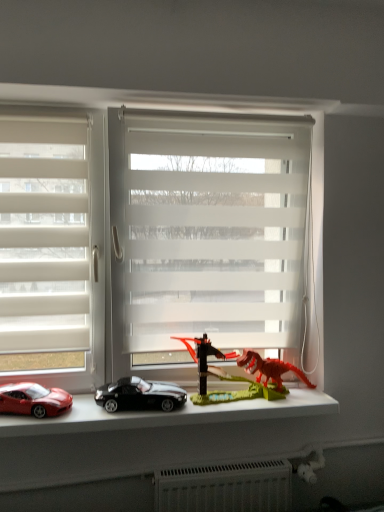
What are the coordinates of `free area below shiny red car at lower left, placed as the 2th car when sorted from right to left (from a real-world perspective)` in the screenshot? It's located at (32, 412).